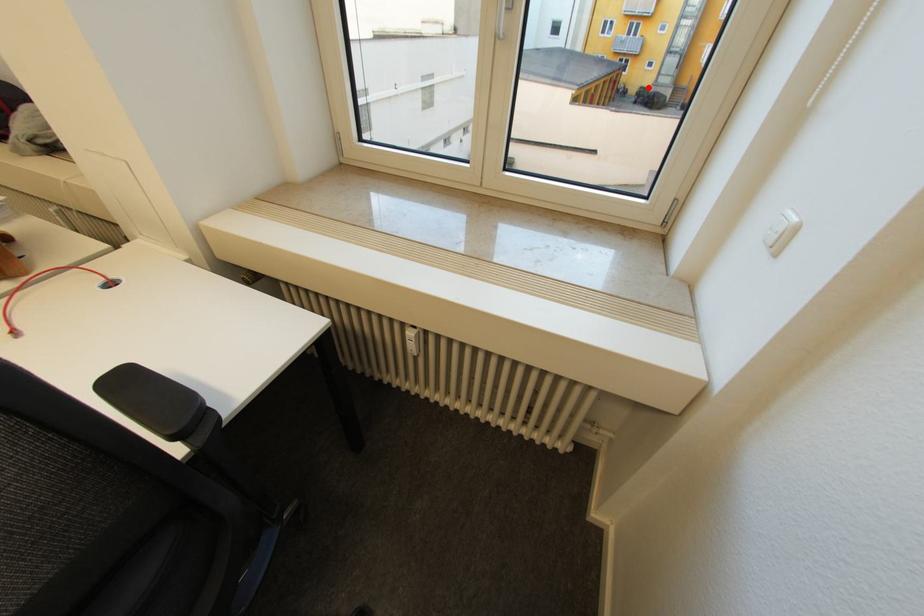
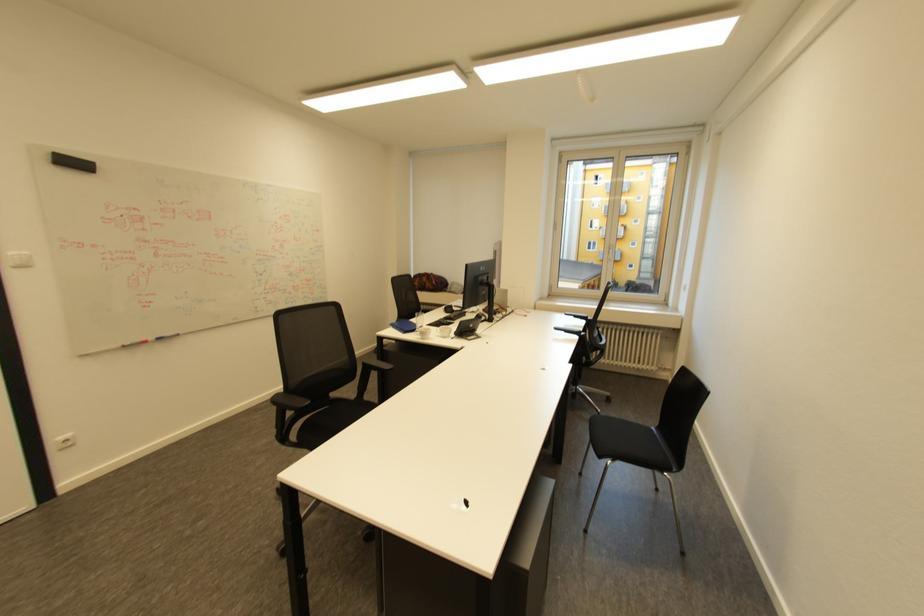
In the second image, find the point that corresponds to the highlighted location in the first image.

(636, 281)